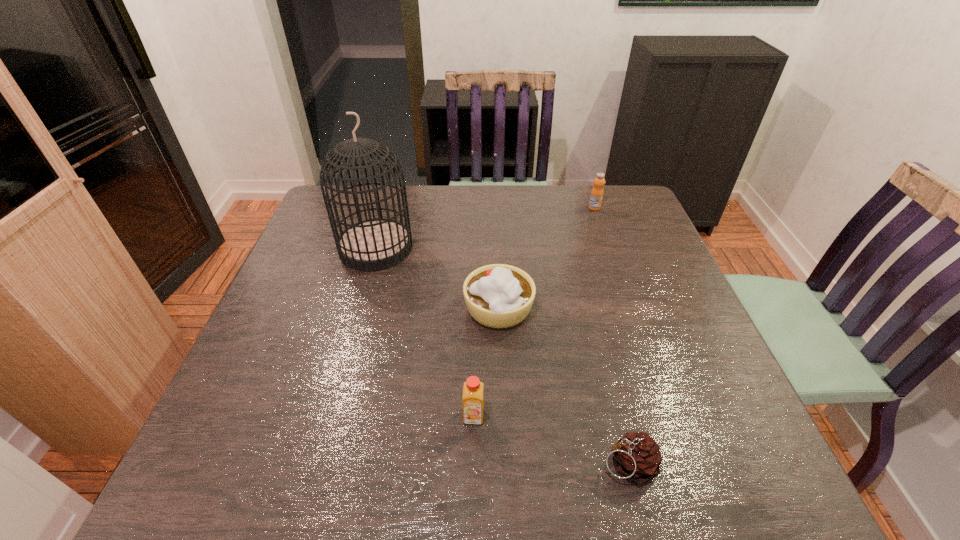
Locate an element on the screen. The image size is (960, 540). the leftmost object is located at coordinates (376, 244).

The height and width of the screenshot is (540, 960). Find the location of `the fourth nearest object`. the fourth nearest object is located at coordinates (376, 244).

Identify the location of whipped cream. (498, 295).

I want to click on the right orange juice, so click(596, 196).

Where is `the rightmost object`? The width and height of the screenshot is (960, 540). the rightmost object is located at coordinates (596, 196).

The image size is (960, 540). What are the coordinates of `the second nearest object` in the screenshot? It's located at (473, 389).

Identify the location of the left orange juice. This screenshot has height=540, width=960. (473, 389).

The height and width of the screenshot is (540, 960). I want to click on the fourth object from left to right, so click(637, 457).

I want to click on the nearest object, so click(x=637, y=457).

I want to click on vacant region located 0.210m on the front of the tallest object, so click(x=352, y=332).